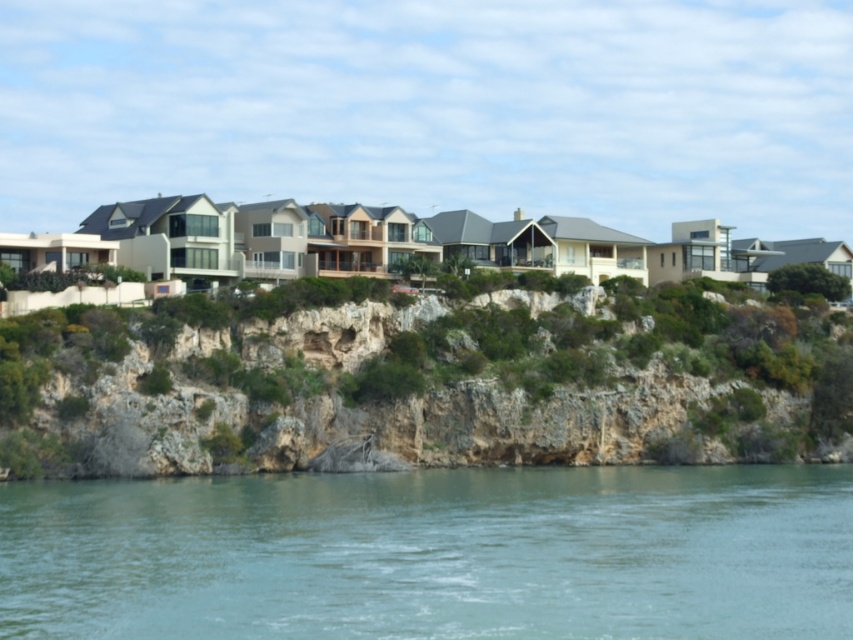
Question: Can you confirm if clear water at lower center is wider than green rocky cliff at center?

Choices:
 (A) no
 (B) yes

Answer: (A)

Question: Which point is closer to the camera?

Choices:
 (A) (177, 346)
 (B) (120, 566)

Answer: (B)

Question: Does clear water at lower center lie behind green rocky cliff at center?

Choices:
 (A) yes
 (B) no

Answer: (B)

Question: Is clear water at lower center to the right of green rocky cliff at center from the viewer's perspective?

Choices:
 (A) no
 (B) yes

Answer: (A)